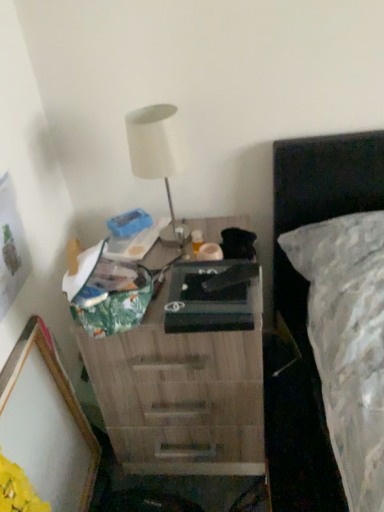
The image size is (384, 512). What do you see at coordinates (46, 423) in the screenshot?
I see `wooden picture frame at lower left` at bounding box center [46, 423].

Locate an element on the screen. This screenshot has width=384, height=512. wooden nightstand at center is located at coordinates (183, 389).

Is white matte table lamp at upper center not inside wooden picture frame at lower left?

white matte table lamp at upper center lies outside wooden picture frame at lower left's area.

Considering the sizes of white matte table lamp at upper center and wooden picture frame at lower left in the image, is white matte table lamp at upper center bigger or smaller than wooden picture frame at lower left?

Considering their sizes, white matte table lamp at upper center takes up less space than wooden picture frame at lower left.

Between white matte table lamp at upper center and wooden picture frame at lower left, which one has larger width?

With larger width is white matte table lamp at upper center.

Considering the positions of objects white matte table lamp at upper center and wooden picture frame at lower left in the image provided, who is in front, white matte table lamp at upper center or wooden picture frame at lower left?

Positioned in front is wooden picture frame at lower left.

Consider the image. Does wooden nightstand at center come behind white matte table lamp at upper center?

No, it is not.

Would you say wooden nightstand at center is inside or outside white matte table lamp at upper center?

wooden nightstand at center is outside white matte table lamp at upper center.

Who is bigger, wooden nightstand at center or white matte table lamp at upper center?

wooden nightstand at center.

Is white matte table lamp at upper center in front of wooden nightstand at center?

No, white matte table lamp at upper center is further to the viewer.

Is white matte table lamp at upper center shorter than wooden nightstand at center?

Correct, white matte table lamp at upper center is not as tall as wooden nightstand at center.

How different are the orientations of white matte table lamp at upper center and wooden nightstand at center in degrees?

0.000594 degrees.

From a real-world perspective, which is physically above, white matte table lamp at upper center or wooden nightstand at center?

In real-world perspective, white matte table lamp at upper center is above.

Who is bigger, wooden nightstand at center or wooden picture frame at lower left?

wooden nightstand at center is bigger.

Is wooden nightstand at center inside or outside of wooden picture frame at lower left?

The correct answer is: outside.

From the picture: Can you tell me how much wooden nightstand at center and wooden picture frame at lower left differ in facing direction?

wooden nightstand at center and wooden picture frame at lower left are facing 91.3 degrees away from each other.

Can you tell me how much wooden picture frame at lower left and wooden nightstand at center differ in facing direction?

91.3 degrees separate the facing orientations of wooden picture frame at lower left and wooden nightstand at center.

Considering the positions of objects wooden picture frame at lower left and wooden nightstand at center in the image provided, who is more to the right, wooden picture frame at lower left or wooden nightstand at center?

wooden nightstand at center is more to the right.

Is wooden picture frame at lower left not within wooden nightstand at center?

wooden picture frame at lower left lies outside wooden nightstand at center's area.

Is wooden picture frame at lower left in front of or behind white matte table lamp at upper center in the image?

Clearly, wooden picture frame at lower left is in front of white matte table lamp at upper center.

Is wooden picture frame at lower left situated inside white matte table lamp at upper center or outside?

wooden picture frame at lower left is outside white matte table lamp at upper center.

Could you tell me if wooden picture frame at lower left is turned towards white matte table lamp at upper center?

No, wooden picture frame at lower left is not facing towards white matte table lamp at upper center.

At what (x,y) coordinates should I click in order to perform the action: click on table lamp on the right of wooden picture frame at lower left. Please return your answer as a coordinate pair (x, y). Looking at the image, I should click on click(x=159, y=156).

This screenshot has width=384, height=512. There is a wooden picture frame at lower left. What are the coordinates of `table lamp above it (from a real-world perspective)` in the screenshot? It's located at (159, 156).

Identify the location of nightstand below the white matte table lamp at upper center (from the image's perspective). (183, 389).

Looking at the image, which one is located further to white matte table lamp at upper center, wooden nightstand at center or wooden picture frame at lower left?

Among the two, wooden picture frame at lower left is located further to white matte table lamp at upper center.

When comparing their distances from wooden picture frame at lower left, does wooden nightstand at center or white matte table lamp at upper center seem further?

white matte table lamp at upper center lies further to wooden picture frame at lower left than the other object.

Looking at this image, based on their spatial positions, is white matte table lamp at upper center or wooden nightstand at center closer to wooden picture frame at lower left?

Among the two, wooden nightstand at center is located nearer to wooden picture frame at lower left.

Which object lies further to the anchor point wooden nightstand at center, wooden picture frame at lower left or white matte table lamp at upper center?

white matte table lamp at upper center.

Considering their positions, is wooden picture frame at lower left positioned further to white matte table lamp at upper center than wooden nightstand at center?

wooden picture frame at lower left lies further to white matte table lamp at upper center than the other object.

Based on the photo, from the image, which object appears to be nearer to wooden nightstand at center, white matte table lamp at upper center or wooden picture frame at lower left?

The object closer to wooden nightstand at center is wooden picture frame at lower left.

Identify the location of nightstand between white matte table lamp at upper center and wooden picture frame at lower left from top to bottom. The height and width of the screenshot is (512, 384). (183, 389).